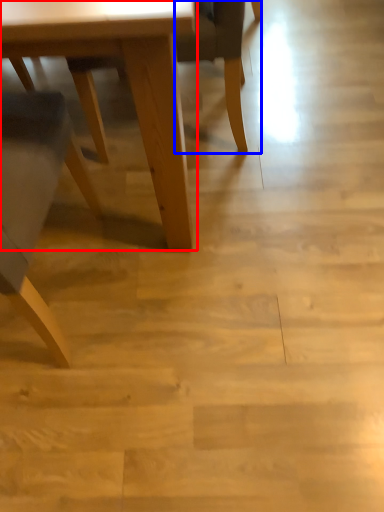
Question: Which object appears farthest to the camera in this image, table (highlighted by a red box) or chair (highlighted by a blue box)?

Choices:
 (A) table
 (B) chair

Answer: (B)